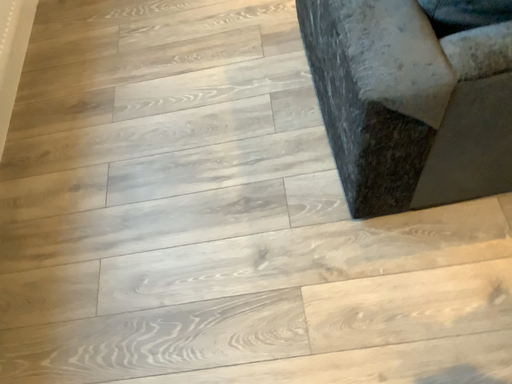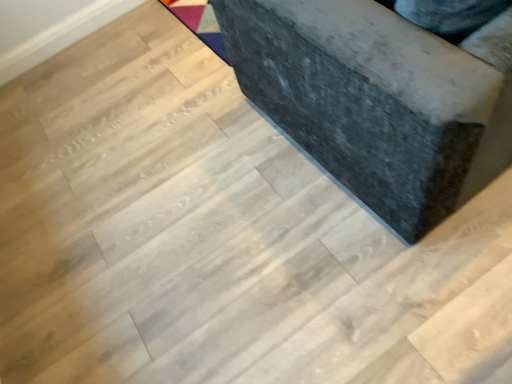
Question: How did the camera likely rotate when shooting the video?

Choices:
 (A) rotated right
 (B) rotated left

Answer: (A)